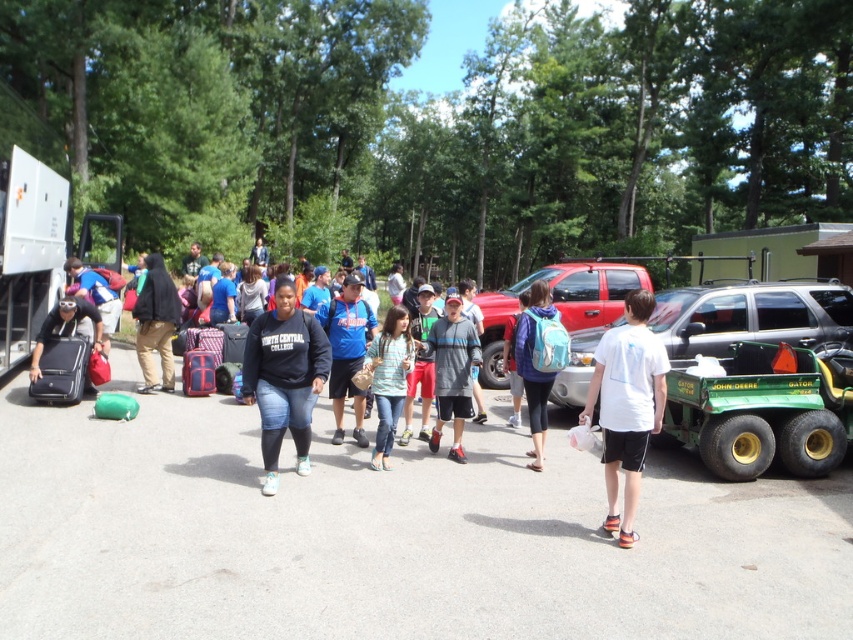
Who is more forward, [422,342] or [230,330]?

Point [422,342]

Between point (456, 333) and point (227, 356), which one is positioned behind?

The point (227, 356) is more distant.

Between point (436, 412) and point (222, 332), which one is positioned behind?

The point (222, 332) is more distant.

Locate an element on the screen. Image resolution: width=853 pixels, height=640 pixels. gray cotton hoodie at center is located at coordinates (451, 372).

Which of these two, teal fabric backpack at center or gray cotton shirt at center, stands taller?

With more height is gray cotton shirt at center.

Between point (534, 308) and point (482, 317), which one is positioned behind?

Positioned behind is point (482, 317).

Image resolution: width=853 pixels, height=640 pixels. Find the location of `teal fabric backpack at center`. teal fabric backpack at center is located at coordinates (538, 360).

Consider the image. Who is more distant from viewer, (306, 412) or (479, 360)?

The point (479, 360) is behind.

How distant is matte black sweatshirt at center from gray cotton hoodie at center?

The distance of matte black sweatshirt at center from gray cotton hoodie at center is 5.65 feet.

Which is behind, point (289, 282) or point (468, 385)?

Positioned behind is point (468, 385).

Where is `matte black sweatshirt at center`? The image size is (853, 640). matte black sweatshirt at center is located at coordinates (283, 378).